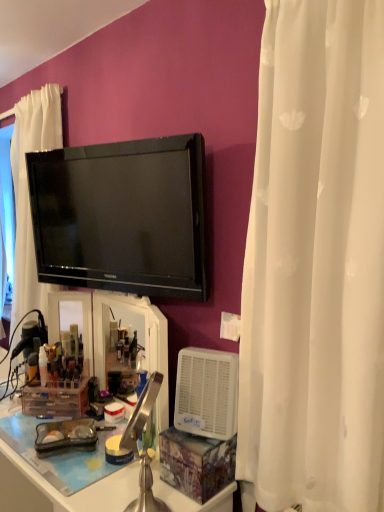
Question: Is black glossy tv at upper center facing towards matte gold tube at left, positioned as the 2th toiletry in right-to-left order?

Choices:
 (A) yes
 (B) no

Answer: (B)

Question: From a real-world perspective, is black glossy tv at upper center positioned over matte gold tube at left, the first toiletry viewed from the left, based on gravity?

Choices:
 (A) no
 (B) yes

Answer: (B)

Question: From the image's perspective, is black glossy tv at upper center located beneath matte gold tube at left, positioned as the 2th toiletry in right-to-left order?

Choices:
 (A) yes
 (B) no

Answer: (B)

Question: Are black glossy tv at upper center and matte gold tube at left, positioned as the 2th toiletry in right-to-left order, beside each other?

Choices:
 (A) no
 (B) yes

Answer: (A)

Question: Would you say black glossy tv at upper center is a long distance from matte gold tube at left, positioned as the 2th toiletry in right-to-left order?

Choices:
 (A) yes
 (B) no

Answer: (B)

Question: Considering the positions of white plastic air purifier at lower right and black glossy tv at upper center in the image, is white plastic air purifier at lower right bigger or smaller than black glossy tv at upper center?

Choices:
 (A) big
 (B) small

Answer: (B)

Question: Is point (177, 421) closer or farther from the camera than point (114, 287)?

Choices:
 (A) closer
 (B) farther

Answer: (A)

Question: From a real-world perspective, is white plastic air purifier at lower right physically located above or below black glossy tv at upper center?

Choices:
 (A) below
 (B) above

Answer: (A)

Question: Is white plastic air purifier at lower right wider or thinner than black glossy tv at upper center?

Choices:
 (A) thin
 (B) wide

Answer: (B)

Question: Considering the relative positions of black glossy tv at upper center and white plastic desk at lower left in the image provided, is black glossy tv at upper center to the left or to the right of white plastic desk at lower left?

Choices:
 (A) right
 (B) left

Answer: (A)

Question: Choose the correct answer: Is black glossy tv at upper center inside white plastic desk at lower left or outside it?

Choices:
 (A) outside
 (B) inside

Answer: (A)

Question: From their relative heights in the image, would you say black glossy tv at upper center is taller or shorter than white plastic desk at lower left?

Choices:
 (A) short
 (B) tall

Answer: (A)

Question: Is black glossy tv at upper center bigger or smaller than white plastic desk at lower left?

Choices:
 (A) big
 (B) small

Answer: (B)

Question: Is white plastic desk at lower left taller or shorter than translucent plastic container at lower left, which is the first toiletry from right to left?

Choices:
 (A) tall
 (B) short

Answer: (A)

Question: Looking at their shapes, would you say white plastic desk at lower left is wider or thinner than translucent plastic container at lower left, which is counted as the second toiletry, starting from the left?

Choices:
 (A) wide
 (B) thin

Answer: (A)